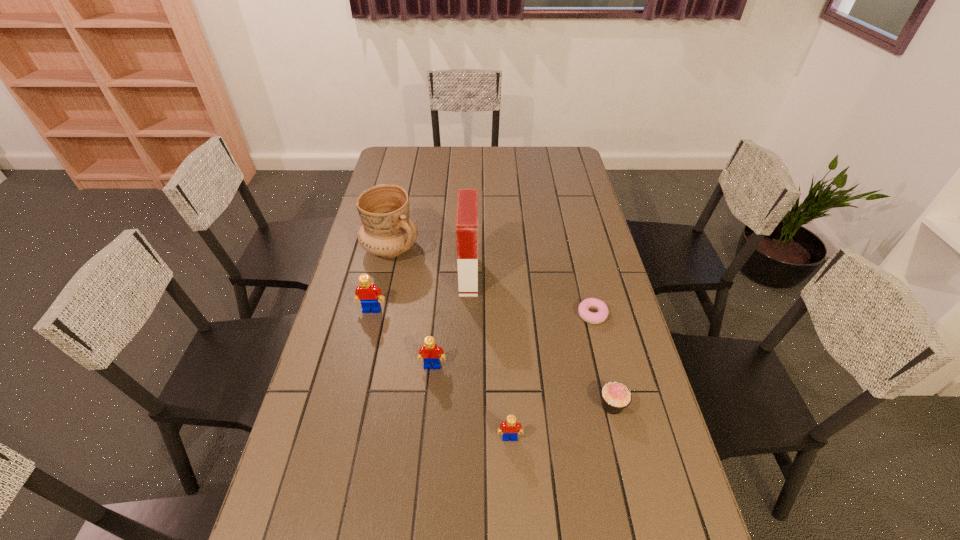
You are a GUI agent. You are given a task and a screenshot of the screen. Output one action in this format:
    pyautogui.click(x=<x>, y=<y>)
    Task: Click on the tallest Lego
    The image size is (960, 540).
    Given the screenshot: What is the action you would take?
    pyautogui.click(x=367, y=293)

The image size is (960, 540). In order to click on the third tallest object in this screenshot , I will do `click(367, 293)`.

At what (x,y) coordinates should I click in order to perform the action: click on the third nearest object. Please return your answer as a coordinate pair (x, y). Looking at the image, I should click on (430, 352).

At what (x,y) coordinates should I click in order to perform the action: click on the fifth object from right to left. Please return your answer as a coordinate pair (x, y). The width and height of the screenshot is (960, 540). Looking at the image, I should click on (430, 352).

I want to click on the nearest Lego, so (511, 428).

You are a GUI agent. You are given a task and a screenshot of the screen. Output one action in this format:
    pyautogui.click(x=<x>, y=<y>)
    Task: Click on the third object from right to left
    The image size is (960, 540).
    Given the screenshot: What is the action you would take?
    pyautogui.click(x=511, y=428)

This screenshot has width=960, height=540. Identify the location of pastry. (590, 303).

Locate an element on the screen. Image resolution: width=960 pixels, height=540 pixels. the tallest object is located at coordinates (467, 201).

Identify the location of the fourth object from left to right. (467, 201).

Identify the location of cupcake. (615, 396).